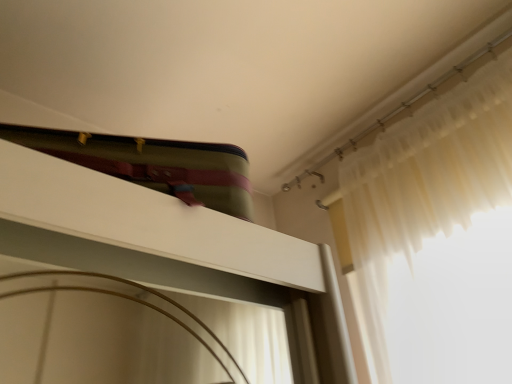
What do you see at coordinates (148, 201) in the screenshot? This screenshot has height=384, width=512. I see `green matte suitcase at upper center` at bounding box center [148, 201].

Identify the location of green matte suitcase at upper center. (148, 201).

Identify the location of green matte suitcase at upper center. (148, 201).